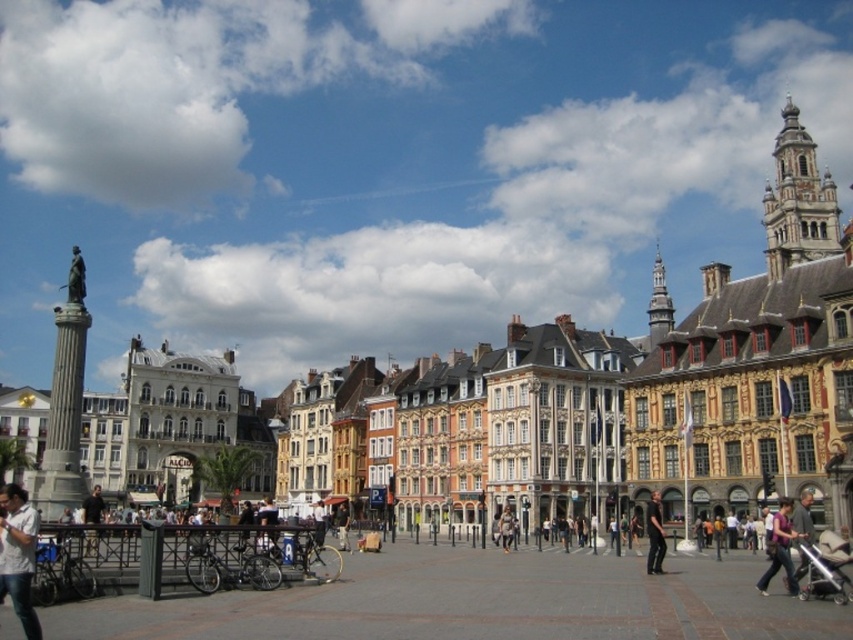
Question: Among these objects, which one is farthest from the camera?

Choices:
 (A) dark gray fabric jacket at lower right
 (B) light brown leather jacket at center

Answer: (B)

Question: Does matte stone statue at left appear on the left side of silver metallic stroller at lower right?

Choices:
 (A) no
 (B) yes

Answer: (A)

Question: Which object is closer to the camera taking this photo?

Choices:
 (A) matte stone statue at left
 (B) dark gray fabric jacket at lower right
 (C) silver metallic stroller at lower right

Answer: (C)

Question: From the image, what is the correct spatial relationship of dark gray fabric jacket at lower right in relation to light brown leather jacket at center?

Choices:
 (A) below
 (B) above

Answer: (B)

Question: Which point appears farthest from the camera in this image?

Choices:
 (A) (548, 476)
 (B) (7, 493)
 (C) (511, 534)

Answer: (A)

Question: Is matte stone statue at left below light brown leather jacket at center?

Choices:
 (A) yes
 (B) no

Answer: (B)